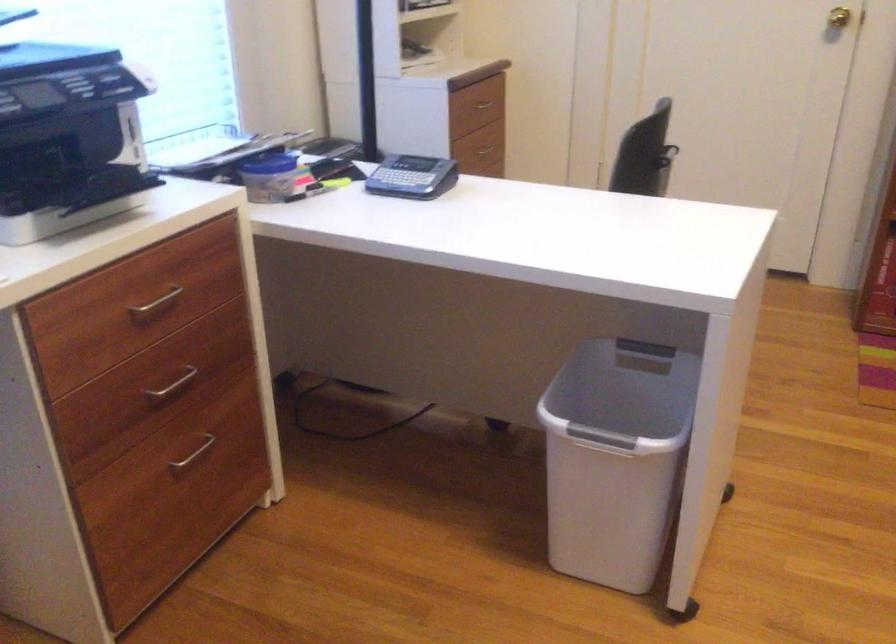
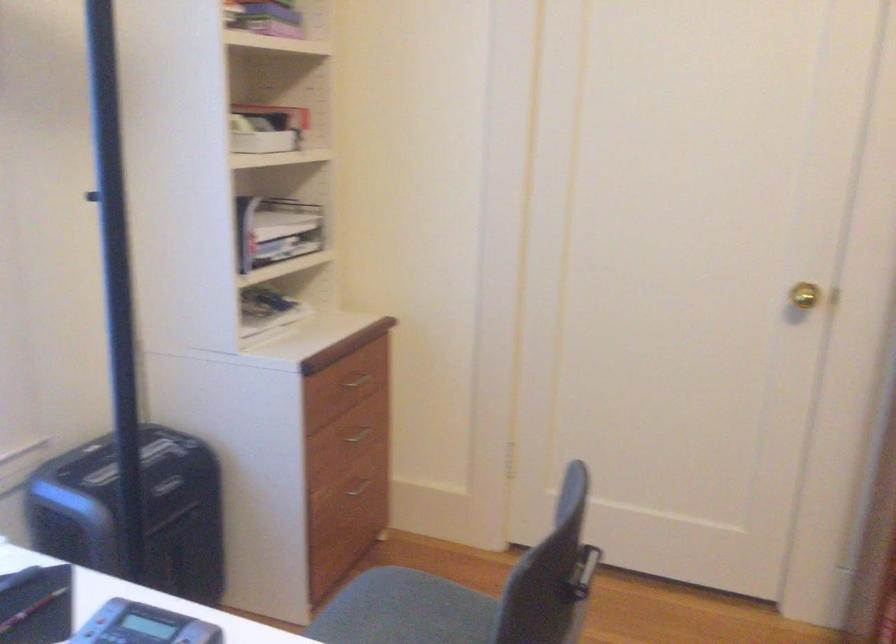
What movement of the cameraman would produce the second image?

The cameraman moved toward right, forward.